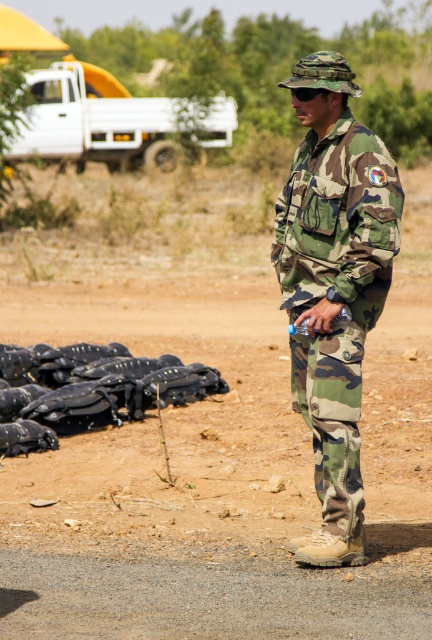
You are a photographer trying to capture both the camo fabric uniform at center and the black matte helmets at lower left in a single frame. Based on their sizes in the image, which object should you focus on first to ensure both are in focus?

The camo fabric uniform at center is much taller than the black matte helmets at lower left, so focusing on the camo fabric uniform at center first would help ensure both are in focus since it is the larger object.

You are a soldier in a military exercise and need to retrieve your black matte helmets at lower left from where you are standing at the camo fabric uniform at center. Considering your gear, which includes a heavy backpack and a rifle, do you think you can reach the helmets without moving more than 3 meters?

The distance between the camo fabric uniform at center and the black matte helmets at lower left is 3.24 meters. Since the required distance to move is more than 3 meters, you cannot retrieve the helmets without exceeding the 3 meter limit.

You are a photographer trying to capture the camo fabric uniform at center and black matte helmets at lower left in the same frame. Based on their positions, which object should you adjust your camera to focus on first to ensure both are in the shot?

You should focus on the camo fabric uniform at center first because it is positioned to the right of the black matte helmets at lower left, so adjusting the camera to include both would require framing from the leftmost object first.